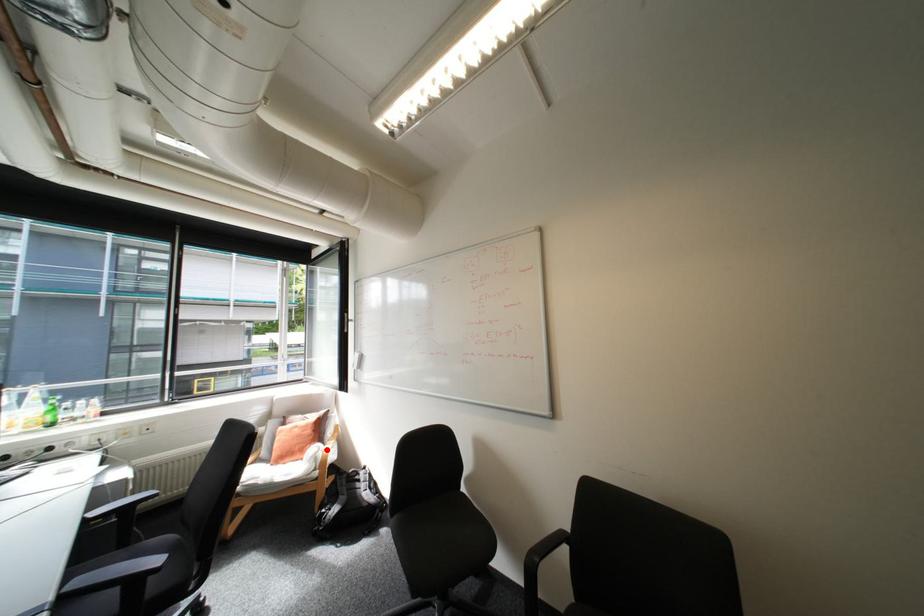
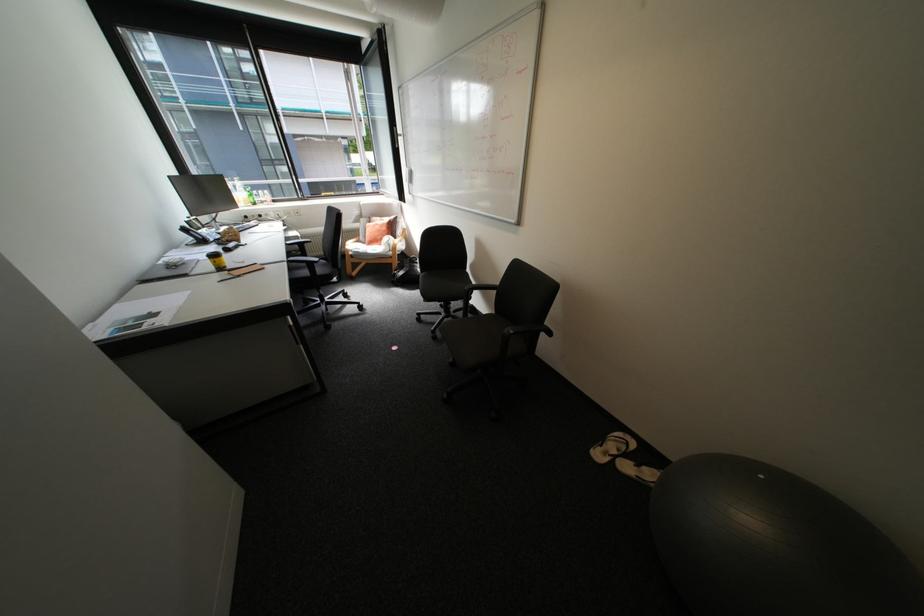
The point at the highlighted location is marked in the first image. Where is the corresponding point in the second image?

(397, 238)